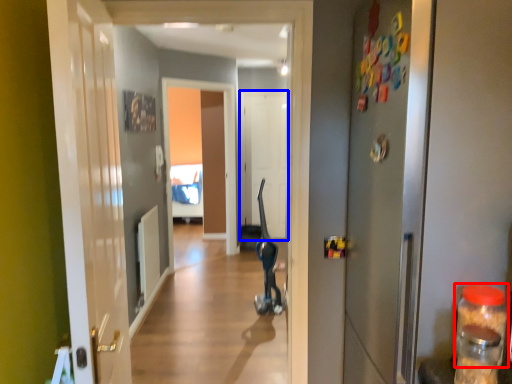
Question: Which object appears closest to the camera in this image, bottle (highlighted by a red box) or door (highlighted by a blue box)?

Choices:
 (A) bottle
 (B) door

Answer: (A)